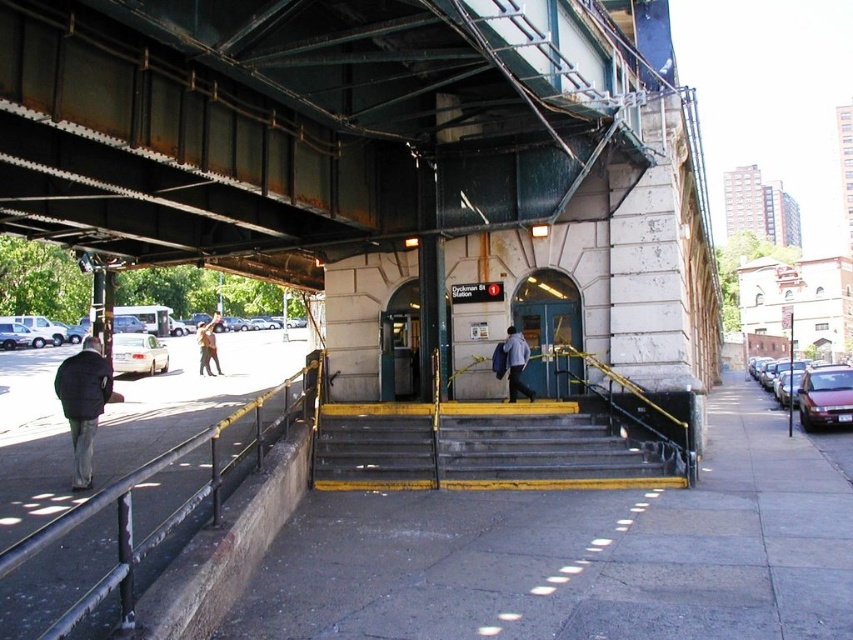
Question: Observing the image, what is the correct spatial positioning of yellow painted metal stairs at center in reference to dark blue jacket at lower left?

Choices:
 (A) right
 (B) left

Answer: (A)

Question: Which object is positioned farthest from the black metal/rail at left?

Choices:
 (A) green glass door at center
 (B) gray concrete pavement at center
 (C) yellow painted metal stairs at center
 (D) camouflage jacket at center

Answer: (D)

Question: Does gray concrete pavement at center appear under dark blue jacket at lower left?

Choices:
 (A) no
 (B) yes

Answer: (B)

Question: Which point is closer to the camera?

Choices:
 (A) (108, 371)
 (B) (521, 305)

Answer: (A)

Question: Which object is the closest to the gray concrete pavement at center?

Choices:
 (A) camouflage jacket at center
 (B) light blue shirt at center

Answer: (B)

Question: Does green glass door at center have a smaller size compared to light blue shirt at center?

Choices:
 (A) no
 (B) yes

Answer: (A)